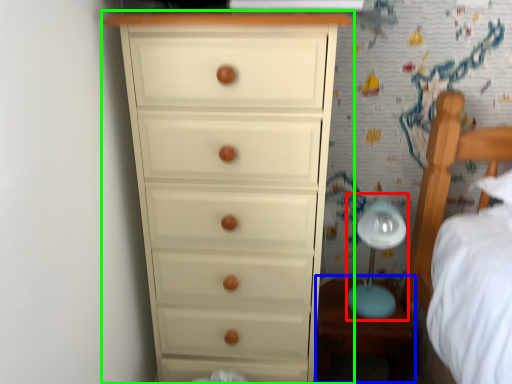
Question: Which object is positioned farthest from table lamp (highlighted by a red box)? Select from table (highlighted by a blue box) and chest of drawers (highlighted by a green box).

Choices:
 (A) table
 (B) chest of drawers

Answer: (B)